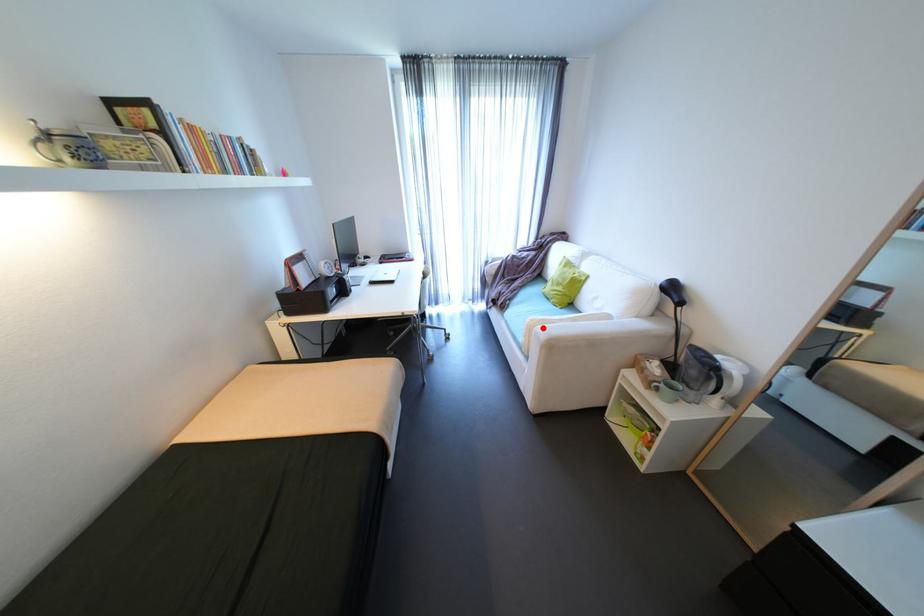
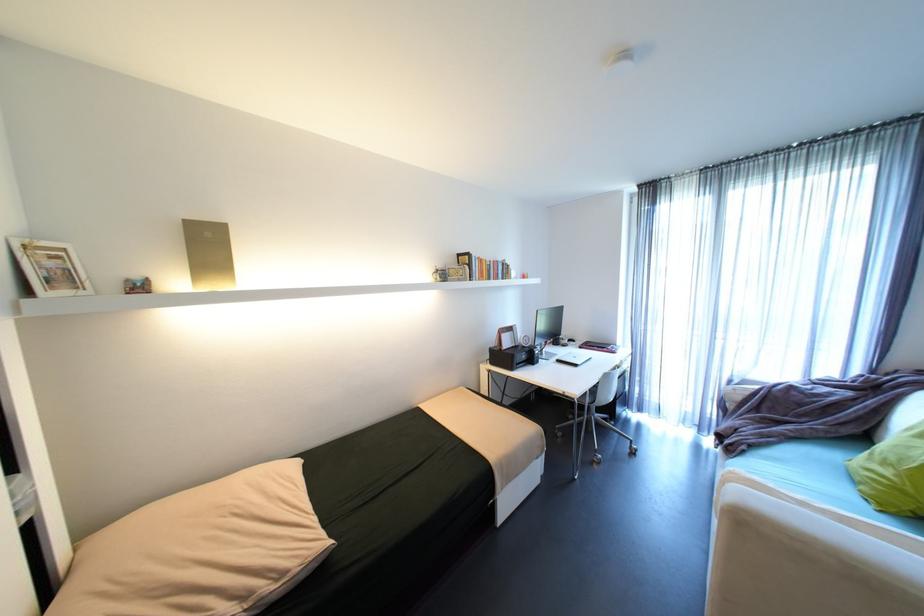
Where in the second image is the point corresponding to the highlighted location from the first image?

(737, 485)